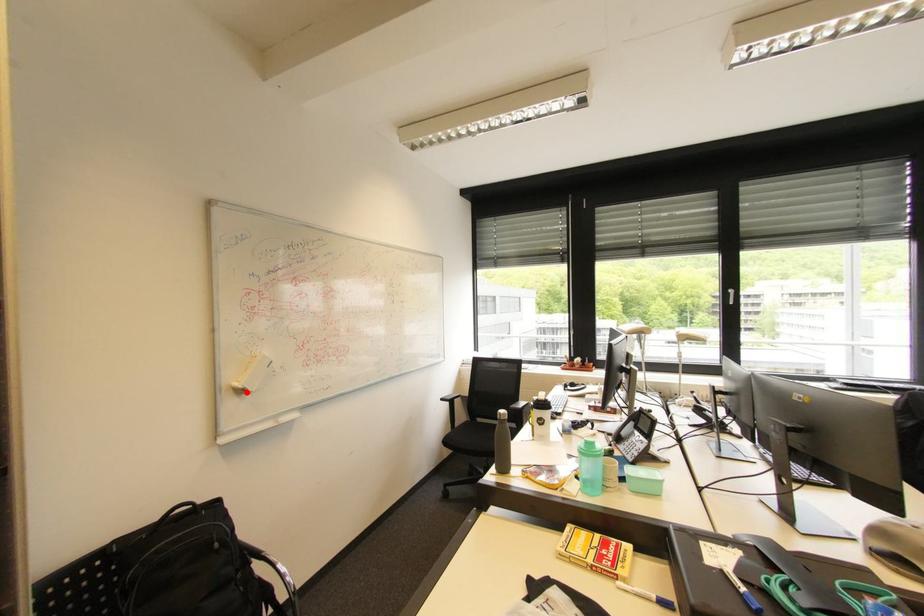
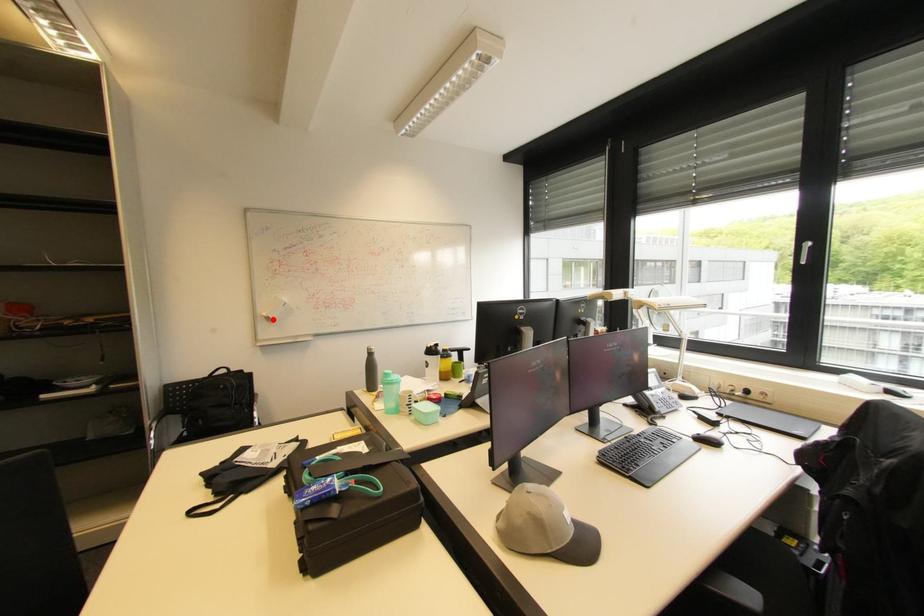
I am providing you with two images of the same scene from different viewpoints. A red point is marked on the first image and another point is marked on the second image. Is the red point in image1 aligned with the point shown in image2?

Yes